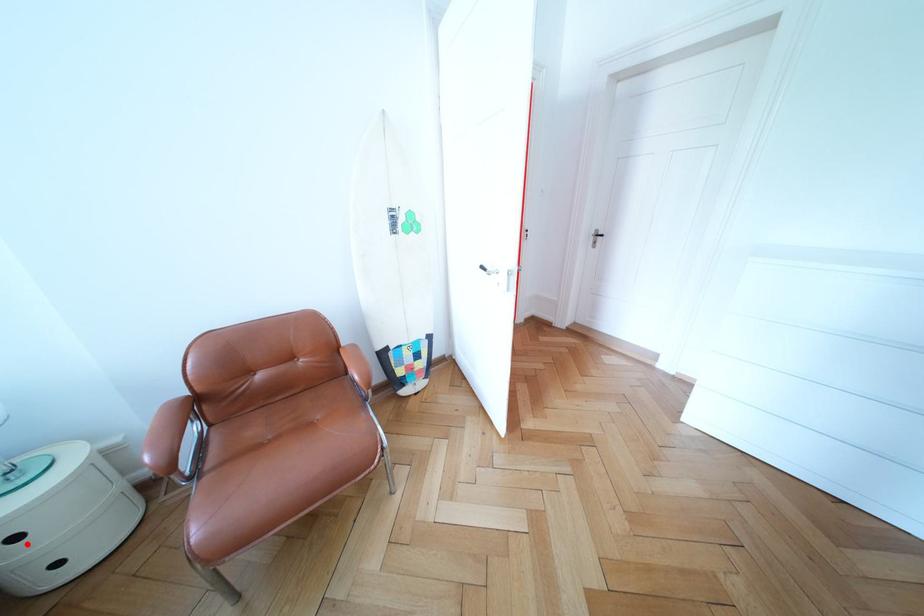
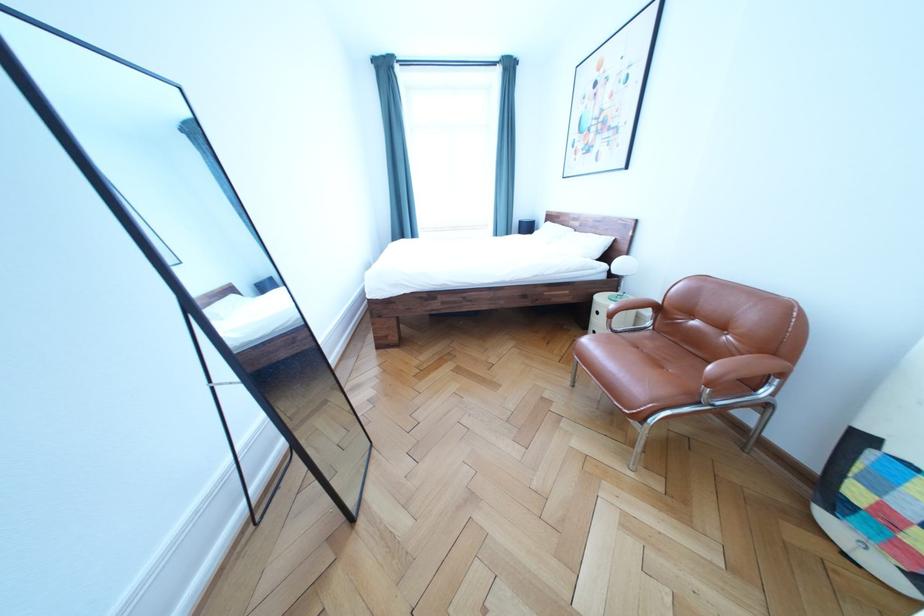
In the second image, find the point that corresponds to the highlighted location in the first image.

(609, 318)